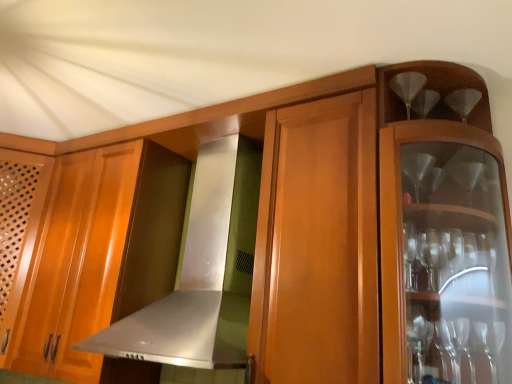
Find the location of a particular element. clear glass wine glass at upper right is located at coordinates (407, 87).

Identify the location of wooden cabinet at left. (18, 229).

Is satin silver exhaust hood at center bigger than clear glass wine glass at upper right?

Yes, satin silver exhaust hood at center is bigger than clear glass wine glass at upper right.

Are satin silver exhaust hood at center and clear glass wine glass at upper right far apart?

No, satin silver exhaust hood at center is not far from clear glass wine glass at upper right.

Which of these two, satin silver exhaust hood at center or clear glass wine glass at upper right, is thinner?

Thinner between the two is clear glass wine glass at upper right.

Considering the positions of objects wooden cabinet at left and clear glass wine glass at upper right in the image provided, who is in front, wooden cabinet at left or clear glass wine glass at upper right?

clear glass wine glass at upper right is closer to the camera.

Would you say wooden cabinet at left is outside clear glass wine glass at upper right?

That's correct, wooden cabinet at left is outside of clear glass wine glass at upper right.

Is wooden cabinet at left taller than clear glass wine glass at upper right?

Indeed, wooden cabinet at left has a greater height compared to clear glass wine glass at upper right.

In terms of height, does clear glass wine glass at upper right look taller or shorter compared to wooden cabinet at left?

Clearly, clear glass wine glass at upper right is shorter compared to wooden cabinet at left.

Which object is wider, clear glass wine glass at upper right or wooden cabinet at left?

With larger width is wooden cabinet at left.

Is clear glass wine glass at upper right positioned with its back to wooden cabinet at left?

No, wooden cabinet at left is not at the back of clear glass wine glass at upper right.

Would you consider wooden cabinet at left to be distant from satin silver exhaust hood at center?

No, wooden cabinet at left is in close proximity to satin silver exhaust hood at center.

Considering their positions, is wooden cabinet at left located in front of or behind satin silver exhaust hood at center?

wooden cabinet at left is behind satin silver exhaust hood at center.

From the image's perspective, is wooden cabinet at left located above or below satin silver exhaust hood at center?

Clearly, from the image's perspective, wooden cabinet at left is below satin silver exhaust hood at center.

Which point is more distant from viewer, (13, 277) or (214, 330)?

The point (13, 277) is behind.

Is clear glass wine glass at upper right behind satin silver exhaust hood at center?

Yes, clear glass wine glass at upper right is behind satin silver exhaust hood at center.

Looking at the image, does clear glass wine glass at upper right seem bigger or smaller compared to satin silver exhaust hood at center?

Considering their sizes, clear glass wine glass at upper right takes up less space than satin silver exhaust hood at center.

Locate an element on the screen. This screenshot has width=512, height=384. exhaust hood that appears below the clear glass wine glass at upper right (from a real-world perspective) is located at coordinates (202, 271).

From a real-world perspective, is satin silver exhaust hood at center located beneath wooden cabinet at left?

No.

Is satin silver exhaust hood at center located outside wooden cabinet at left?

satin silver exhaust hood at center lies outside wooden cabinet at left's area.

Considering the relative positions of satin silver exhaust hood at center and wooden cabinet at left in the image provided, is satin silver exhaust hood at center to the right of wooden cabinet at left from the viewer's perspective?

Yes.

Who is taller, satin silver exhaust hood at center or wooden cabinet at left?

Standing taller between the two is wooden cabinet at left.

Locate an element on the screen. This screenshot has width=512, height=384. wine glass behind the satin silver exhaust hood at center is located at coordinates (407, 87).

Where is `wine glass lying on the right of wooden cabinet at left`? This screenshot has width=512, height=384. wine glass lying on the right of wooden cabinet at left is located at coordinates (407, 87).

Which object lies further to the anchor point clear glass wine glass at upper right, satin silver exhaust hood at center or wooden cabinet at left?

wooden cabinet at left lies further to clear glass wine glass at upper right than the other object.

Looking at the image, which one is located further to satin silver exhaust hood at center, wooden cabinet at left or clear glass wine glass at upper right?

Among the two, clear glass wine glass at upper right is located further to satin silver exhaust hood at center.

Looking at the image, which one is located further to wooden cabinet at left, clear glass wine glass at upper right or satin silver exhaust hood at center?

clear glass wine glass at upper right.

When comparing their distances from satin silver exhaust hood at center, does clear glass wine glass at upper right or wooden cabinet at left seem closer?

wooden cabinet at left is positioned closer to the anchor satin silver exhaust hood at center.

Looking at the image, which one is located further to clear glass wine glass at upper right, wooden cabinet at left or satin silver exhaust hood at center?

Among the two, wooden cabinet at left is located further to clear glass wine glass at upper right.

Which object lies further to the anchor point wooden cabinet at left, satin silver exhaust hood at center or clear glass wine glass at upper right?

The object further to wooden cabinet at left is clear glass wine glass at upper right.

Locate an element on the screen. Image resolution: width=512 pixels, height=384 pixels. exhaust hood between wooden cabinet at left and clear glass wine glass at upper right is located at coordinates (202, 271).